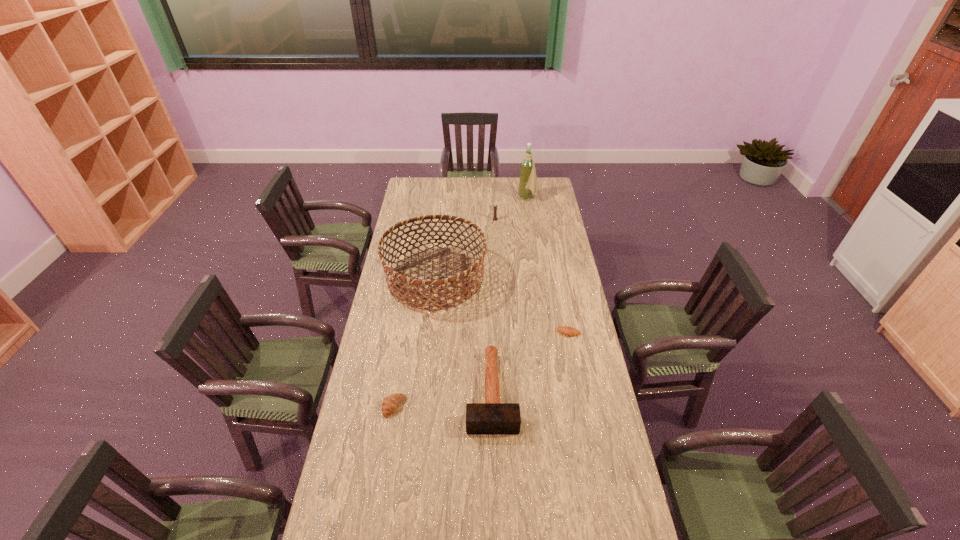
The height and width of the screenshot is (540, 960). What are the coordinates of `wine bottle` in the screenshot? It's located at (528, 180).

The width and height of the screenshot is (960, 540). I want to click on the farthest object, so click(528, 180).

Where is `basket`? The width and height of the screenshot is (960, 540). basket is located at coordinates (401, 288).

The image size is (960, 540). What are the coordinates of `the second tallest object` in the screenshot? It's located at (401, 288).

Find the location of `candle holder`. candle holder is located at coordinates (495, 205).

The height and width of the screenshot is (540, 960). Identify the location of the second farthest object. (495, 205).

Where is `the third shortest object`? The height and width of the screenshot is (540, 960). the third shortest object is located at coordinates (492, 417).

You are a GUI agent. You are given a task and a screenshot of the screen. Output one action in this format:
    pyautogui.click(x=<x>, y=<y>)
    Task: Click on the nearer crescent roll
    This screenshot has height=540, width=960.
    Given the screenshot: What is the action you would take?
    pyautogui.click(x=391, y=403)

Image resolution: width=960 pixels, height=540 pixels. Find the location of `the left crescent roll`. the left crescent roll is located at coordinates (391, 403).

This screenshot has height=540, width=960. I want to click on the shorter crescent roll, so click(x=566, y=330).